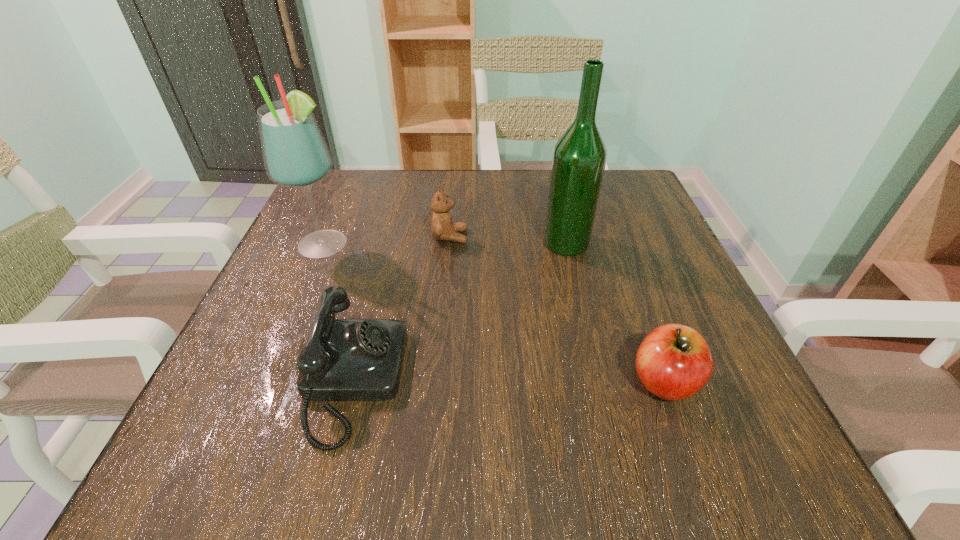
Where is `empty space between the right alcohol and the teddy bear`? empty space between the right alcohol and the teddy bear is located at coordinates (508, 240).

You are a GUI agent. You are given a task and a screenshot of the screen. Output one action in this format:
    pyautogui.click(x=<x>, y=<y>)
    Task: Click on the free space between the teddy bear and the apple
    This screenshot has width=960, height=540.
    Given the screenshot: What is the action you would take?
    pyautogui.click(x=557, y=309)

I want to click on free space between the right alcohol and the telephone, so click(460, 312).

Choose which object is the fourth nearest neighbor to the teddy bear. Please provide its 2D coordinates. Your answer should be formatted as a tuple, i.e. [(x, y)], where the tuple contains the x and y coordinates of a point satisfying the conditions above.

[(674, 362)]

Select which object is the third closest to the telephone. Please provide its 2D coordinates. Your answer should be formatted as a tuple, i.e. [(x, y)], where the tuple contains the x and y coordinates of a point satisfying the conditions above.

[(579, 157)]

The height and width of the screenshot is (540, 960). In order to click on free space in the image that satisfies the following two spatial constraints: 1. on the back side of the apple; 2. on the face of the teddy bear in this screenshot , I will do `click(611, 237)`.

This screenshot has width=960, height=540. What are the coordinates of `vacant region that satisfies the following two spatial constraints: 1. on the dial of the telephone; 2. on the back side of the apple` in the screenshot? It's located at (353, 381).

You are a GUI agent. You are given a task and a screenshot of the screen. Output one action in this format:
    pyautogui.click(x=<x>, y=<y>)
    Task: Click on the vacant area that satisfies the following two spatial constraints: 1. on the face of the teddy bear; 2. on the back side of the apple
    Image resolution: width=960 pixels, height=540 pixels.
    Given the screenshot: What is the action you would take?
    pyautogui.click(x=438, y=381)

Locate an element on the screen. This screenshot has width=960, height=540. blank space that satisfies the following two spatial constraints: 1. on the back side of the apple; 2. on the dial of the telephone is located at coordinates (663, 381).

Where is `free point that satisfies the following two spatial constraints: 1. on the face of the third object from left to right; 2. on the left side of the right alcohol`? free point that satisfies the following two spatial constraints: 1. on the face of the third object from left to right; 2. on the left side of the right alcohol is located at coordinates (449, 242).